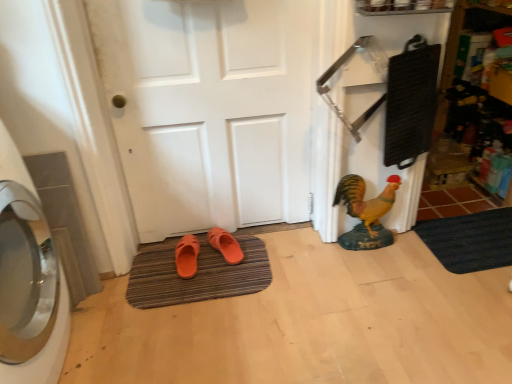
This screenshot has width=512, height=384. In order to click on vacant space in front of orange rubber slipper at lower center, which is the second footwear from right to left in this screenshot , I will do `click(179, 292)`.